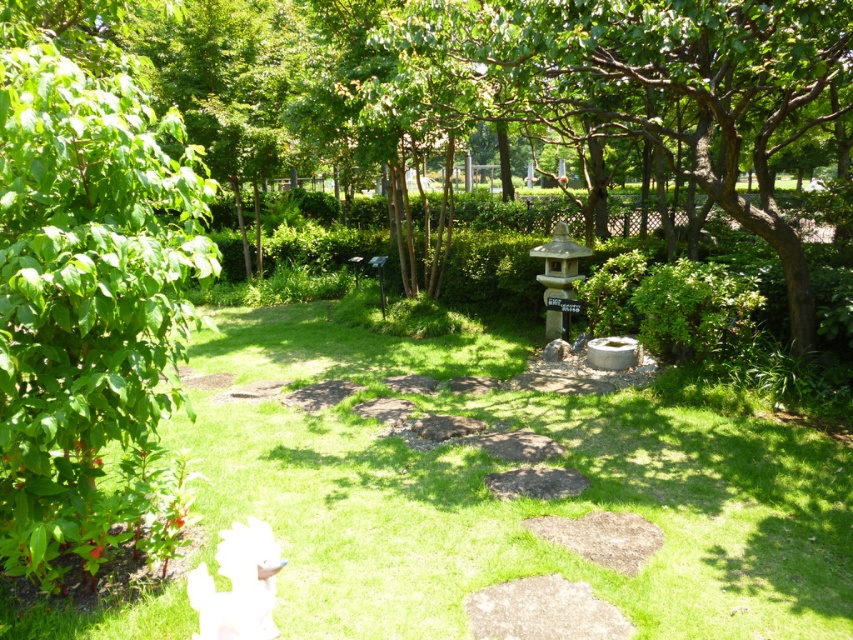
Can you confirm if green grass at center is shorter than smooth stone lantern at center?

Correct, green grass at center is not as tall as smooth stone lantern at center.

Is point (213, 477) positioned after point (448, 58)?

That is False.

What do you see at coordinates (508, 500) in the screenshot?
I see `green grass at center` at bounding box center [508, 500].

Where is `green grass at center`? Image resolution: width=853 pixels, height=640 pixels. green grass at center is located at coordinates (508, 500).

Does green leafy tree at left lie behind smooth stone lantern at center?

That is False.

In order to click on green leafy tree at left in this screenshot , I will do `click(84, 272)`.

Who is taller, green grass at center or green leafy tree at left?

With more height is green leafy tree at left.

Which is more to the left, green grass at center or green leafy tree at left?

From the viewer's perspective, green leafy tree at left appears more on the left side.

Find the location of a particular element. This screenshot has height=640, width=853. green grass at center is located at coordinates (508, 500).